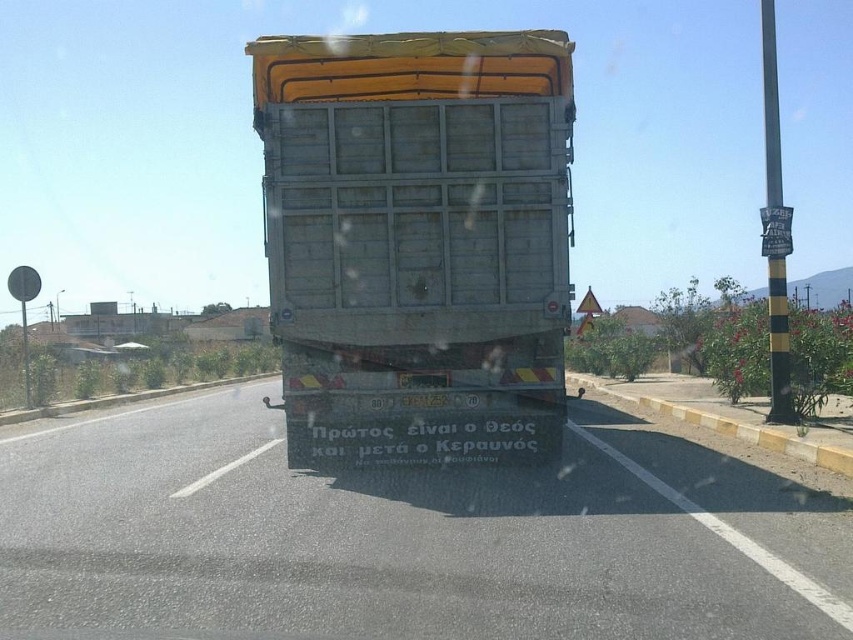
Is metallic truck at center below rusty metal trailer truck at center?

Yes.

Who is more distant from viewer, [664,518] or [341,392]?

The point [341,392] is more distant.

The height and width of the screenshot is (640, 853). What do you see at coordinates (408, 536) in the screenshot?
I see `metallic truck at center` at bounding box center [408, 536].

The width and height of the screenshot is (853, 640). Identify the location of metallic truck at center. (408, 536).